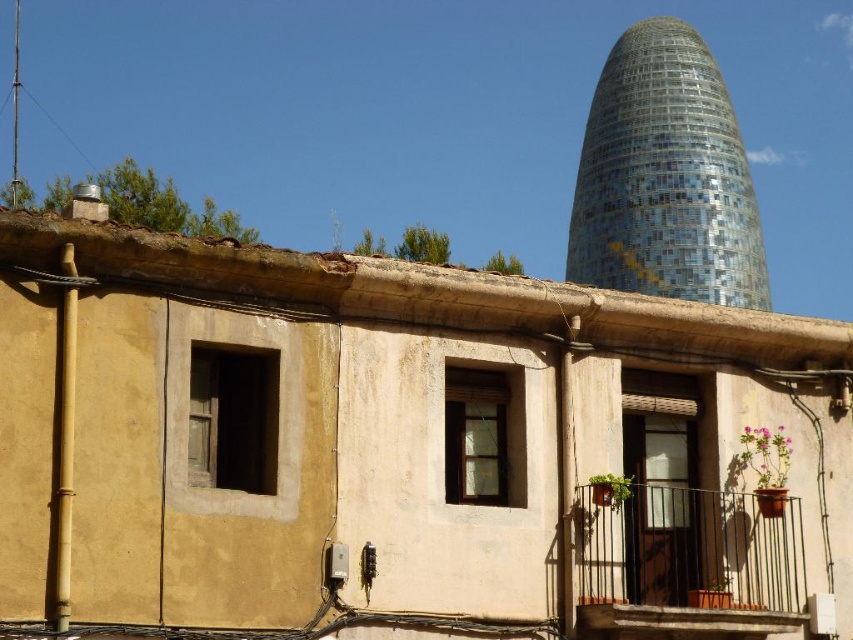
Can you confirm if blue mosaic tower at upper center is wider than brown wrought iron balcony at lower right?

Correct, the width of blue mosaic tower at upper center exceeds that of brown wrought iron balcony at lower right.

Is point (730, 209) in front of point (741, 504)?

No, it is behind (741, 504).

Where is `blue mosaic tower at upper center`? blue mosaic tower at upper center is located at coordinates (665, 177).